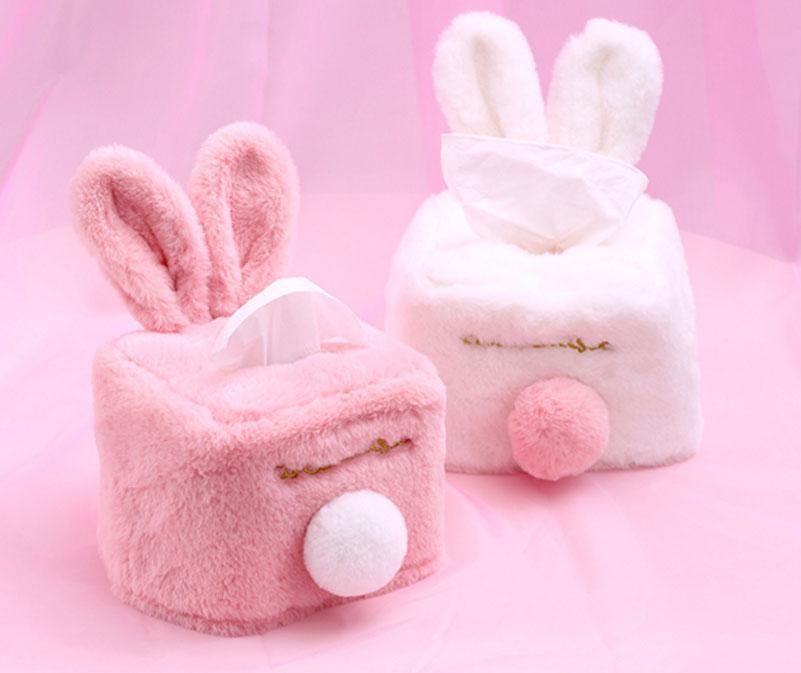
The width and height of the screenshot is (801, 673). Identify the location of pink walls. (109, 61), (707, 90).